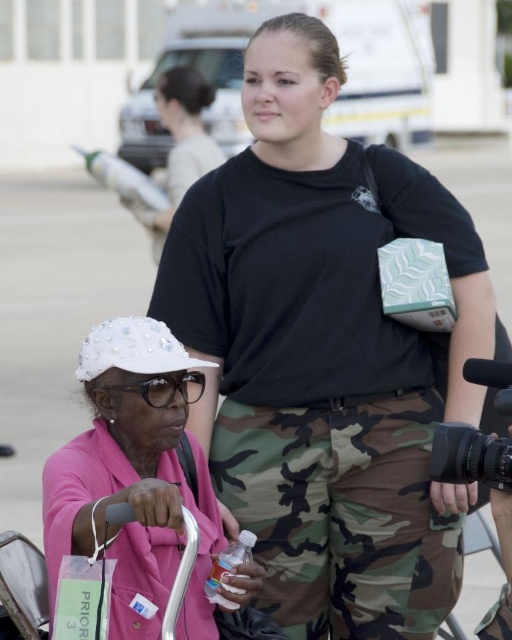
Looking at this image, you are a photographer at an outdoor event. You want to take a photo of the white pearl hat at lower left and the matte black shirt at upper center. The camera you are using has a maximum focus range of 35 feet. Will you be able to capture both subjects in focus without moving the camera?

The white pearl hat at lower left and matte black shirt at upper center are 38.66 feet apart. Since the camera can only focus up to 35 feet, the distance between them exceeds the maximum focus range. Therefore, you cannot capture both subjects in focus without moving the camera.

You are a photographer at the event and want to capture a clear shot of the camo pants at center and the translucent plastic bottle at lower center. Which object should you focus on first to ensure both are in focus without moving the camera?

You should focus on the camo pants at center first because the translucent plastic bottle at lower center is behind it, so focusing on the closer object ensures both will be in focus when using a small aperture.